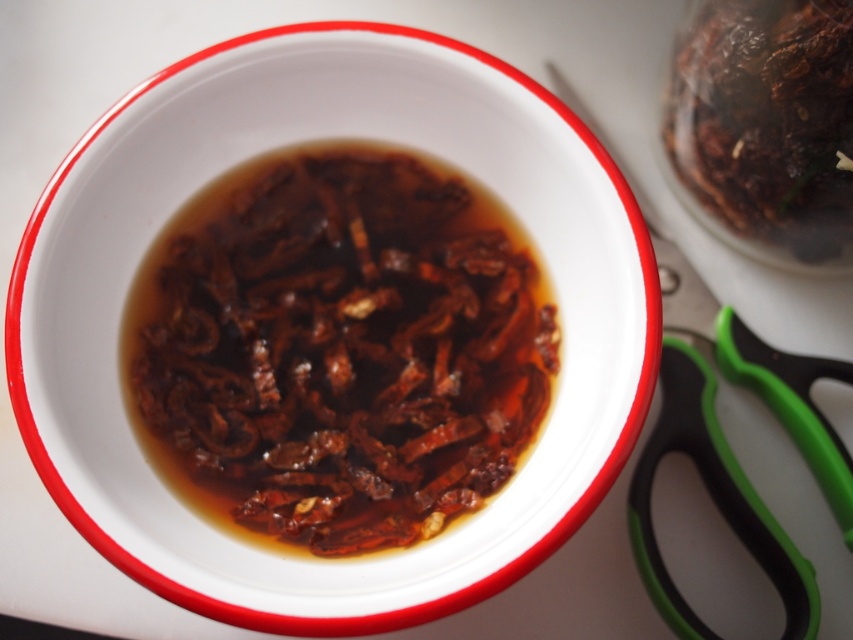
Question: Can you confirm if brown glossy dried chilies at center is positioned to the left of brown glossy dried chilies at upper right?

Choices:
 (A) yes
 (B) no

Answer: (A)

Question: Which point is farther to the camera?

Choices:
 (A) brown glossy dried chilies at center
 (B) brown glossy dried chilies at upper right
 (C) green plastic scissors at lower right

Answer: (C)

Question: Does brown glossy dried chilies at center have a smaller size compared to brown glossy dried chilies at upper right?

Choices:
 (A) yes
 (B) no

Answer: (B)

Question: Which of the following is the closest to the observer?

Choices:
 (A) (544, 337)
 (B) (703, 314)
 (C) (824, 16)

Answer: (C)

Question: Which object is closer to the camera taking this photo?

Choices:
 (A) green plastic scissors at lower right
 (B) brown glossy dried chilies at center
 (C) brown glossy dried chilies at upper right

Answer: (C)

Question: Observing the image, what is the correct spatial positioning of brown glossy dried chilies at upper right in reference to green plastic scissors at lower right?

Choices:
 (A) right
 (B) left

Answer: (A)